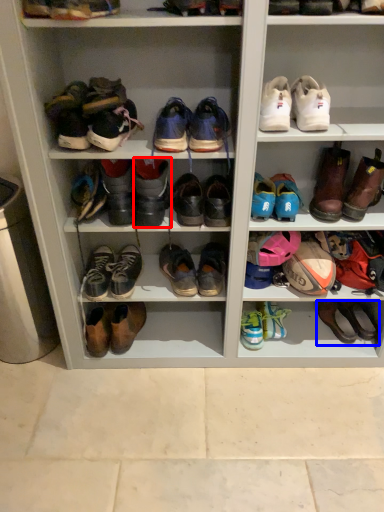
Question: Which of the following is the closest to the observer, footwear (highlighted by a red box) or footwear (highlighted by a blue box)?

Choices:
 (A) footwear
 (B) footwear

Answer: (A)